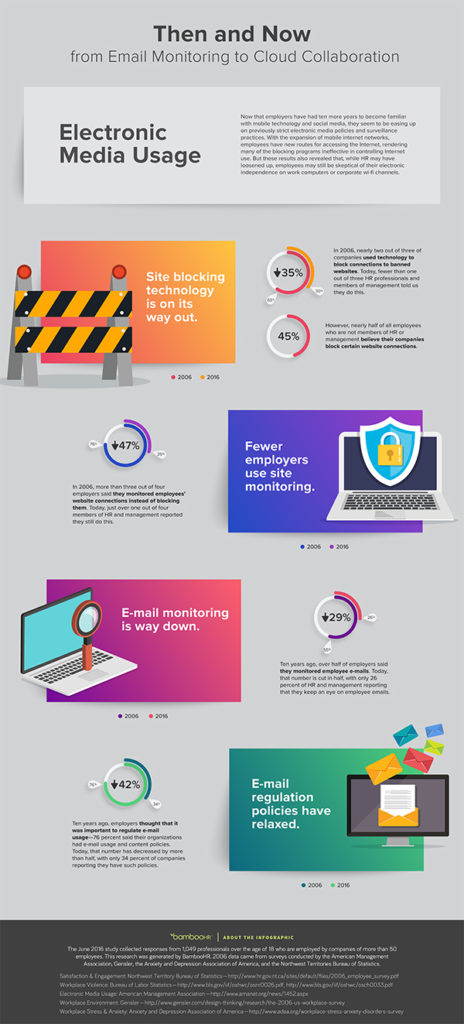
This screenshot has height=1024, width=464. I want to click on laptop computer, so click(x=112, y=667).